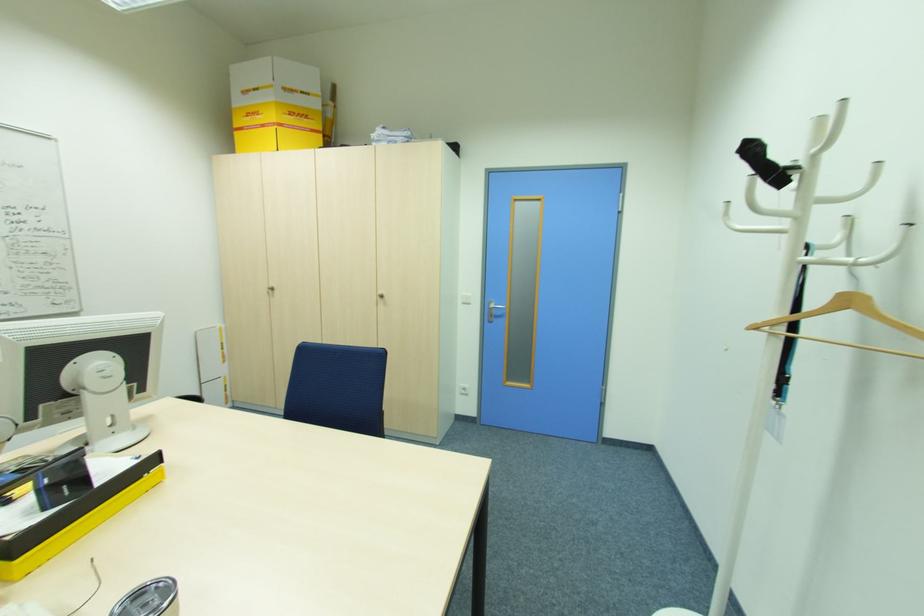
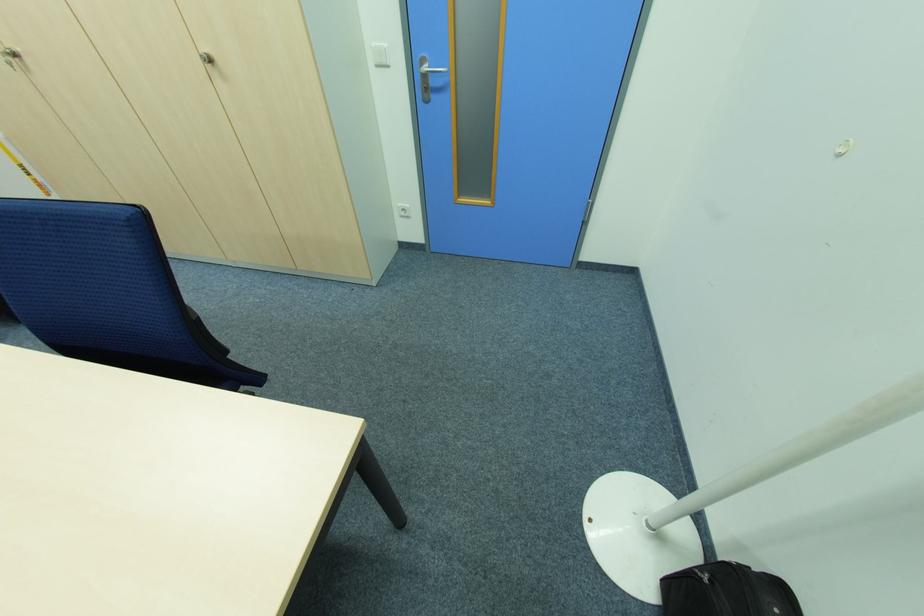
In the second image, find the point that corresponds to point 272,293 in the first image.

(14, 65)